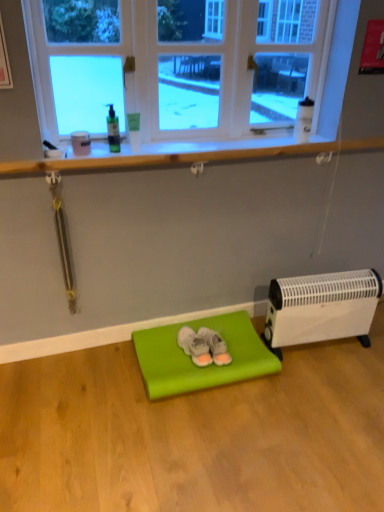
At what (x,y) coordinates should I click in order to perform the action: click on vacant space that is to the left of matte green yoga mat at center. Please return your answer as a coordinate pair (x, y). This screenshot has height=512, width=384. Looking at the image, I should click on (95, 387).